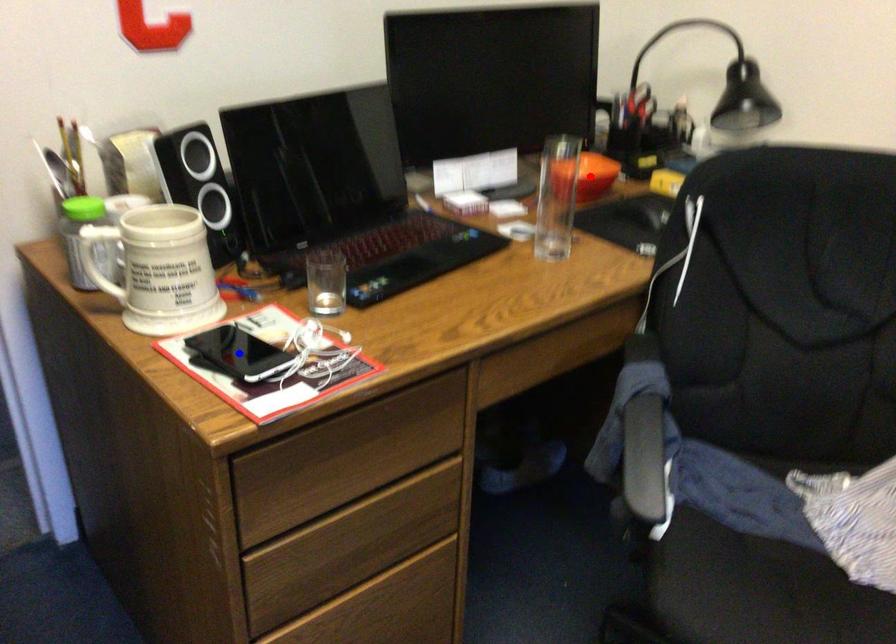
Question: In the image, two points are highlighted. Which point is nearer to the camera? Reply with the corresponding letter.

Choices:
 (A) blue point
 (B) red point

Answer: (A)